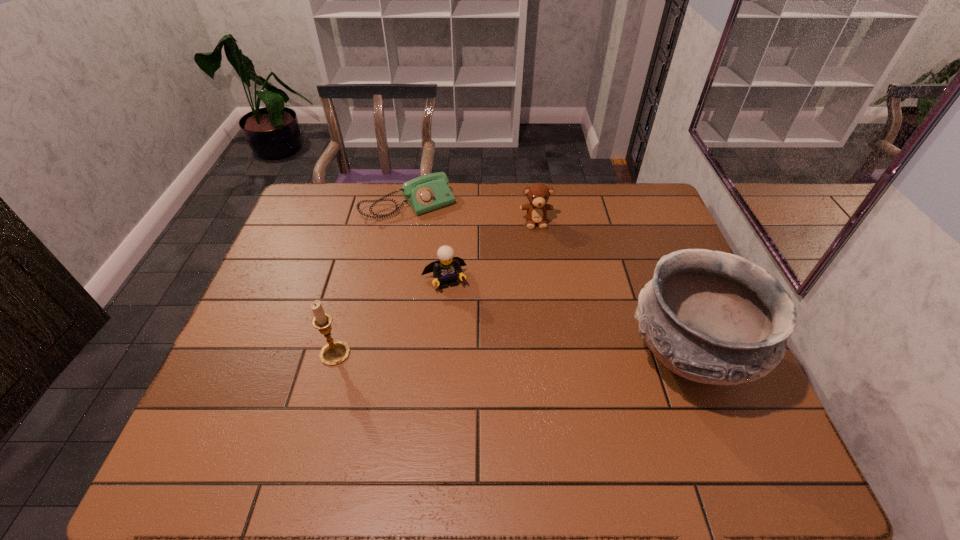
The width and height of the screenshot is (960, 540). Identify the location of free point between the fourth shortest object and the fourth object from left to right. (436, 288).

Locate an element on the screen. The height and width of the screenshot is (540, 960). free spot between the second tallest object and the second object from right to left is located at coordinates (436, 288).

At what (x,y) coordinates should I click in order to perform the action: click on empty space between the telephone and the rightmost object. Please return your answer as a coordinate pair (x, y). The width and height of the screenshot is (960, 540). Looking at the image, I should click on (548, 281).

You are a GUI agent. You are given a task and a screenshot of the screen. Output one action in this format:
    pyautogui.click(x=<x>, y=<y>)
    Task: Click on the vacant area between the telephone and the teddy bear
    The height and width of the screenshot is (540, 960).
    Given the screenshot: What is the action you would take?
    pyautogui.click(x=472, y=213)

Find the location of a particular element. vacant space that is in between the second object from right to left and the tallest object is located at coordinates (612, 289).

This screenshot has width=960, height=540. Identify the location of vacant space that is in between the tallest object and the telephone. (548, 281).

Identify the location of free space between the Lego and the second object from right to left. (490, 252).

Image resolution: width=960 pixels, height=540 pixels. I want to click on blank region between the rightmost object and the third farthest object, so click(565, 319).

Locate an element on the screen. Image resolution: width=960 pixels, height=540 pixels. object that is the fourth closest to the pottery is located at coordinates tap(334, 353).

Identify which object is the third closest to the tallest object. Please provide its 2D coordinates. Your answer should be formatted as a tuple, i.e. [(x, y)], where the tuple contains the x and y coordinates of a point satisfying the conditions above.

[(428, 192)]